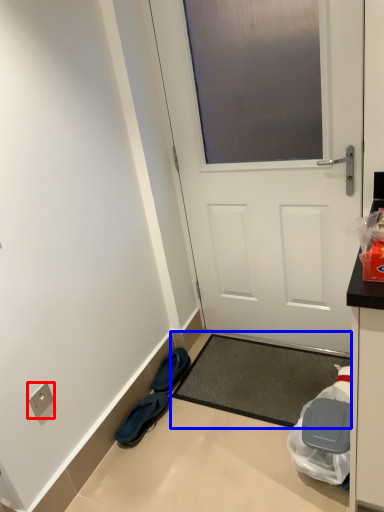
Question: Among these objects, which one is farthest to the camera, electric outlet (highlighted by a red box) or doormat (highlighted by a blue box)?

Choices:
 (A) electric outlet
 (B) doormat

Answer: (B)